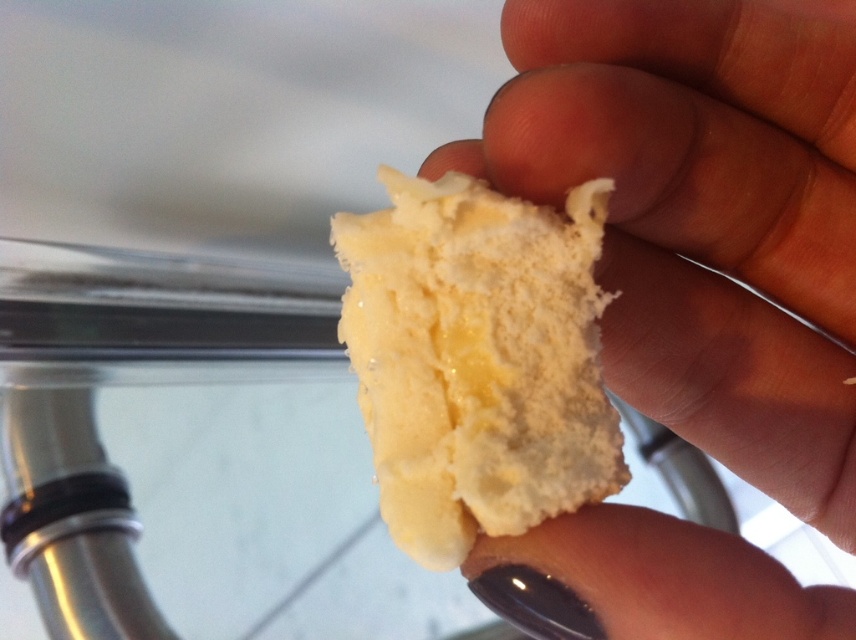
You are a baker trying to determine which sponge to use for a cake. The recipe requires a taller sponge. Based on the image, which one between the white fluffy sponge at center and the yellow creamy sponge at center should you choose?

The white fluffy sponge at center is taller than the yellow creamy sponge at center, so you should choose the white fluffy sponge at center for the cake recipe.

You are a chef preparing a dessert and have two sponges in front of you, the white fluffy sponge at center and the yellow creamy sponge at center. Which sponge is positioned to the right of the other?

The white fluffy sponge at center is to the right of the yellow creamy sponge at center.

You are a baker trying to place both the white fluffy sponge at center and the yellow creamy sponge at center on a baking tray that is 4 inches wide. Can both fit side by side without overlapping?

The white fluffy sponge at center and yellow creamy sponge at center are 4.44 inches apart, so they cannot fit side by side on a 4 inch wide tray since the combined width exceeds the tray size.